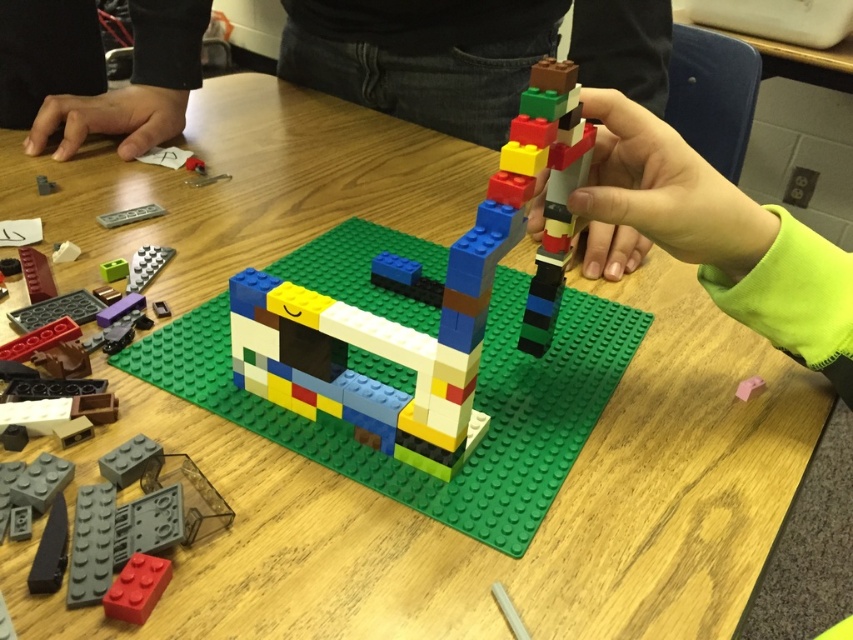
Question: Which of the following is the farthest from the observer?

Choices:
 (A) pink rubber eraser at center
 (B) multicolored plastic blocks at center
 (C) black fabric hand at upper left

Answer: (C)

Question: Does smooth plastic hand at center right appear on the left side of pink rubber eraser at center?

Choices:
 (A) no
 (B) yes

Answer: (B)

Question: Can you confirm if smooth plastic hand at center right is positioned to the left of black fabric hand at upper left?

Choices:
 (A) yes
 (B) no

Answer: (B)

Question: Considering the real-world distances, which object is closest to the black fabric hand at upper left?

Choices:
 (A) multicolored plastic blocks at center
 (B) smooth plastic hand at center right

Answer: (A)

Question: Which object is farther from the camera taking this photo?

Choices:
 (A) black fabric hand at upper left
 (B) pink rubber eraser at center
 (C) smooth plastic hand at center right
 (D) multicolored plastic blocks at center

Answer: (A)

Question: Can you confirm if multicolored plastic blocks at center is wider than pink rubber eraser at center?

Choices:
 (A) yes
 (B) no

Answer: (A)